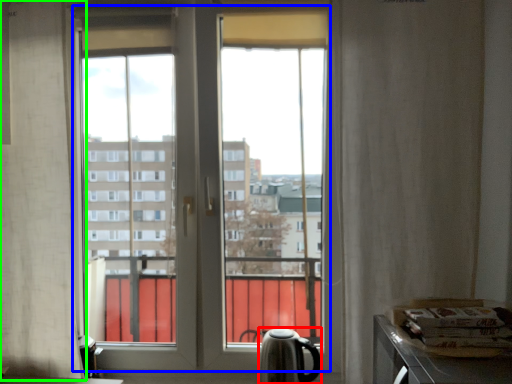
Question: Based on their relative distances, which object is nearer to tea pot (highlighted by a red box)? Choose from bay window (highlighted by a blue box) and curtain (highlighted by a green box).

Choices:
 (A) bay window
 (B) curtain

Answer: (A)